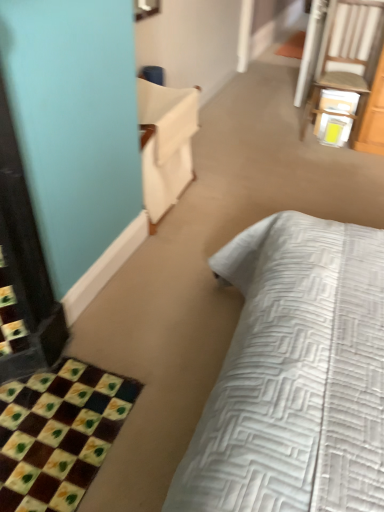
Question: Does checkerboard fabric bath mat at lower left lie behind white fabric armchair at upper left?

Choices:
 (A) yes
 (B) no

Answer: (B)

Question: Are checkerboard fabric bath mat at lower left and white fabric armchair at upper left making contact?

Choices:
 (A) no
 (B) yes

Answer: (A)

Question: Does checkerboard fabric bath mat at lower left have a greater height compared to white fabric armchair at upper left?

Choices:
 (A) yes
 (B) no

Answer: (B)

Question: From the image's perspective, is checkerboard fabric bath mat at lower left located above white fabric armchair at upper left?

Choices:
 (A) yes
 (B) no

Answer: (B)

Question: Is there a large distance between checkerboard fabric bath mat at lower left and white fabric armchair at upper left?

Choices:
 (A) no
 (B) yes

Answer: (B)

Question: Is checkerboard fabric bath mat at lower left smaller than white fabric armchair at upper left?

Choices:
 (A) no
 (B) yes

Answer: (B)

Question: From the image's perspective, is checkerboard fabric bath mat at lower left above white wood chair at upper right?

Choices:
 (A) yes
 (B) no

Answer: (B)

Question: Can you see checkerboard fabric bath mat at lower left touching white wood chair at upper right?

Choices:
 (A) yes
 (B) no

Answer: (B)

Question: Does checkerboard fabric bath mat at lower left have a larger size compared to white wood chair at upper right?

Choices:
 (A) no
 (B) yes

Answer: (A)

Question: Would you say checkerboard fabric bath mat at lower left contains white wood chair at upper right?

Choices:
 (A) yes
 (B) no

Answer: (B)

Question: Can you confirm if checkerboard fabric bath mat at lower left is positioned to the left of white wood chair at upper right?

Choices:
 (A) no
 (B) yes

Answer: (B)

Question: Would you consider checkerboard fabric bath mat at lower left to be distant from white wood chair at upper right?

Choices:
 (A) yes
 (B) no

Answer: (A)

Question: Can you confirm if white wood chair at upper right is thinner than white fabric armchair at upper left?

Choices:
 (A) yes
 (B) no

Answer: (B)